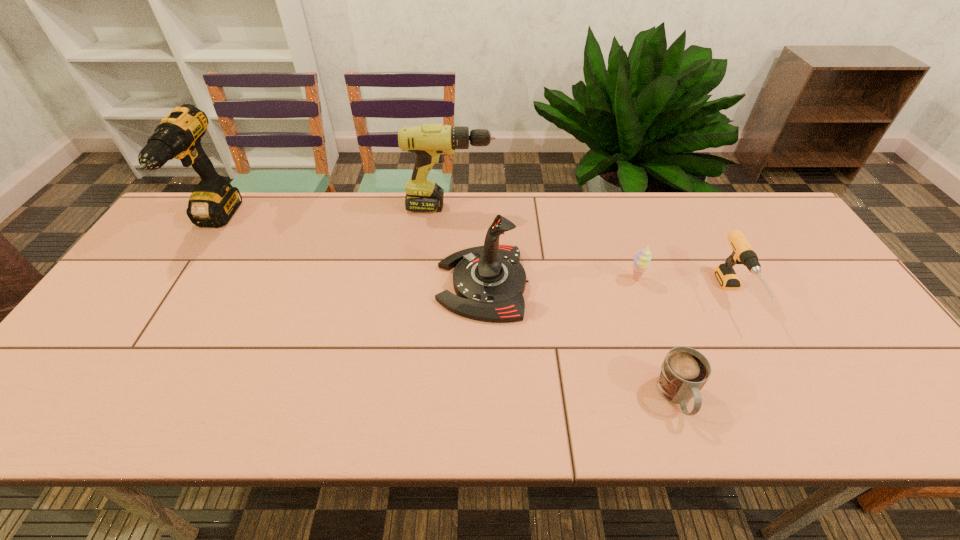
The height and width of the screenshot is (540, 960). I want to click on vacant space that's between the second drill from left to right and the second shortest object, so click(x=542, y=242).

You are a GUI agent. You are given a task and a screenshot of the screen. Output one action in this format:
    pyautogui.click(x=<x>, y=<y>)
    Task: Click on the empty space that is in between the second shortest object and the rightmost object
    
    Given the screenshot: What is the action you would take?
    pyautogui.click(x=684, y=286)

This screenshot has width=960, height=540. I want to click on vacant space in between the leftmost object and the fifth tallest object, so click(x=425, y=250).

Find the location of a particular element. free space between the second drill from right to left and the shortest drill is located at coordinates (591, 251).

Find the location of `object that ranks as the second closest to the nearest object`. object that ranks as the second closest to the nearest object is located at coordinates (642, 257).

Find the location of a particular element. The height and width of the screenshot is (540, 960). object that is the third closest to the second shortest object is located at coordinates (489, 281).

Locate which drill ranks in proximity to the mug. Please provide its 2D coordinates. Your answer should be formatted as a tuple, i.e. [(x, y)], where the tuple contains the x and y coordinates of a point satisfying the conditions above.

[(743, 253)]

Identify the location of drill object that ranks as the closest to the fourth shortest object. The image size is (960, 540). (430, 142).

Locate an element on the screen. This screenshot has width=960, height=540. free spot that satisfies the following two spatial constraints: 1. on the handle side of the second drill from left to right; 2. at the tip of the leftmost drill is located at coordinates (449, 222).

The width and height of the screenshot is (960, 540). Identify the location of free point that satisfies the following two spatial constraints: 1. on the handle side of the second drill from right to left; 2. at the tip of the leftmost object. (449, 222).